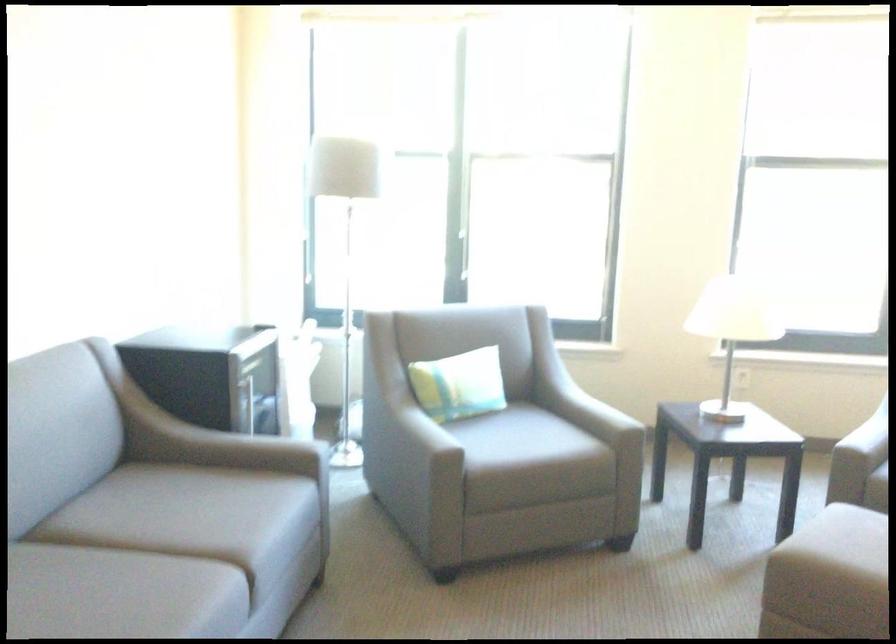
Find where to rest the grey chair armrest. Please return your answer as a coordinate pair (x, y).

(356, 420)